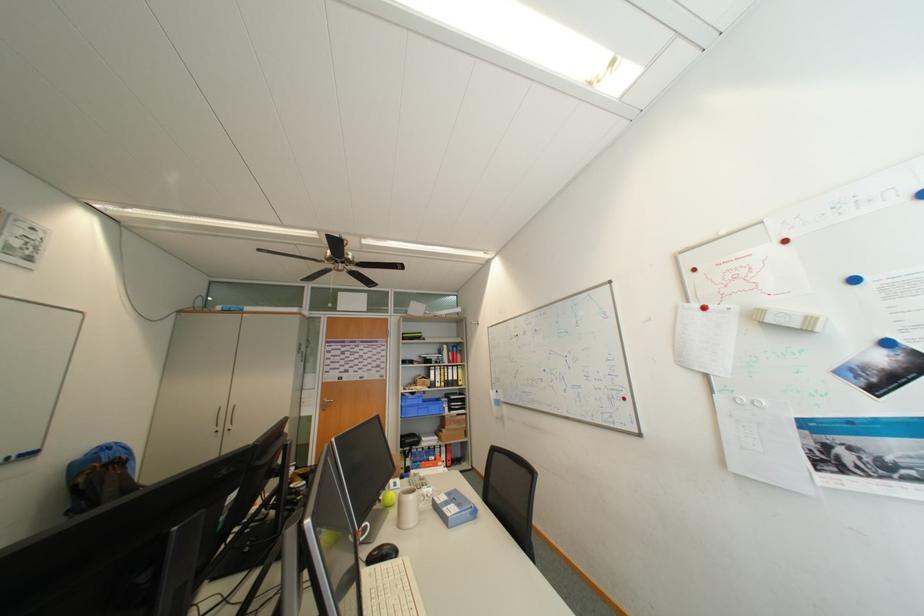
The width and height of the screenshot is (924, 616). What do you see at coordinates (419, 405) in the screenshot?
I see `a blue plastic bin` at bounding box center [419, 405].